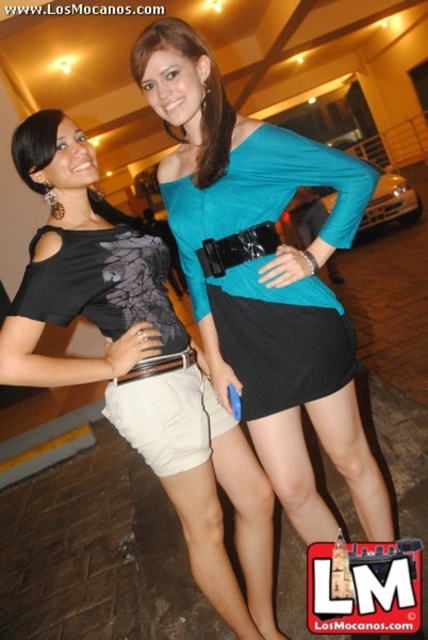
Consider the image. You are an artist trying to sketch the image. To accurately place the teal matte top at center, what are the coordinates you should use?

The teal matte top at center should be placed at coordinates (265,278).

Based on the scene description, where is the matte blue top at center located in terms of coordinates?

The matte blue top at center is located at coordinates point (205, 92).